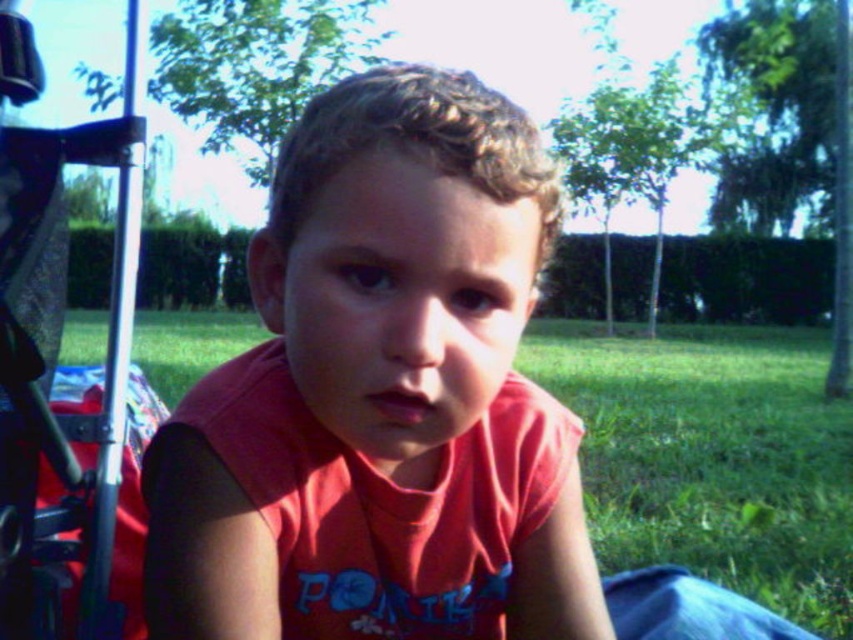
You are a parent trying to move the metallic silver baby carriage at left closer to the green grass at center where your child is sitting. Can you push the carriage directly towards the grass without moving the grass?

The green grass at center is further to the viewer than the metallic silver baby carriage at left, so pushing the carriage forward would move it closer to the grass without needing to move the grass itself.

You are a photographer trying to capture a closeup of the matte red shirt at center and the green grass at center. Which object will appear larger in your photo?

The green grass at center will appear larger in the photo because the matte red shirt at center is smaller than the green grass at center.